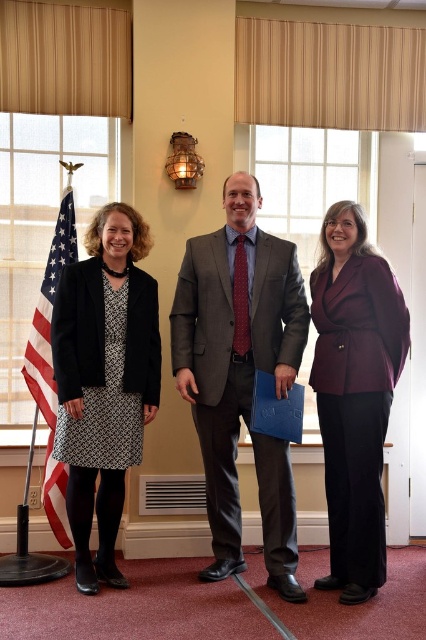
You are standing in the room described in the scene. You need to place a small decorative item exactly at the point marked by the coordinates point (354, 394). According to the scene description, what object will this item be placed on?

The point (354, 394) marks the burgundy wool blazer at center, so the decorative item will be placed on the burgundy wool blazer at center.

Where is the matte gray suit at center located in the image?

The matte gray suit at center is located at point coordinates of [233,346].